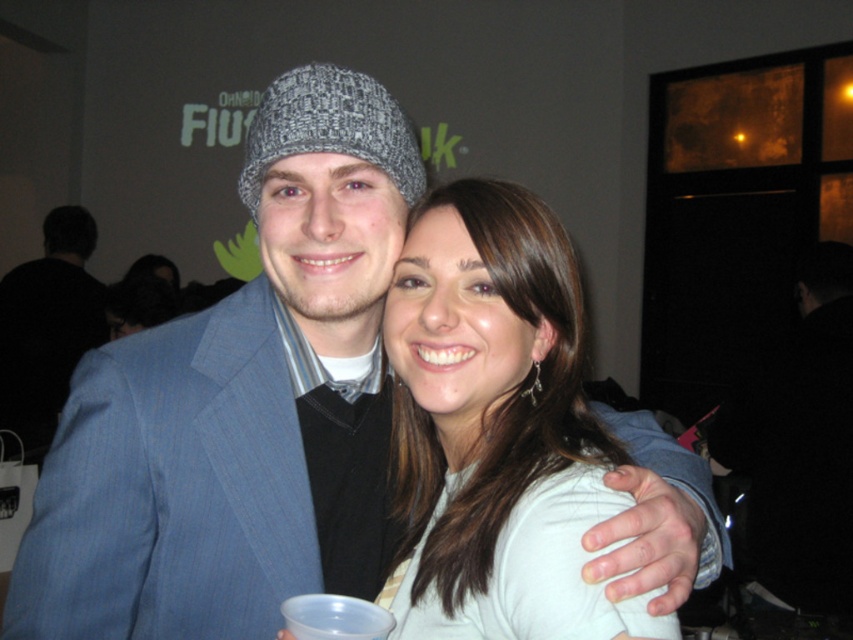
Question: Is white matte shirt at center thinner than black fabric jacket at right?

Choices:
 (A) yes
 (B) no

Answer: (A)

Question: Considering the real-world distances, which object is closest to the black fabric jacket at right?

Choices:
 (A) matte gray beanie at left
 (B) white matte shirt at center

Answer: (B)

Question: Can you confirm if white matte shirt at center is positioned below matte gray beanie at left?

Choices:
 (A) no
 (B) yes

Answer: (B)

Question: Can you confirm if black fabric jacket at right is positioned to the left of matte gray beanie at left?

Choices:
 (A) no
 (B) yes

Answer: (A)

Question: Among these points, which one is nearest to the camera?

Choices:
 (A) (70, 212)
 (B) (846, 570)
 (C) (563, 381)

Answer: (C)

Question: Among these points, which one is nearest to the camera?

Choices:
 (A) (48, 337)
 (B) (473, 352)

Answer: (B)